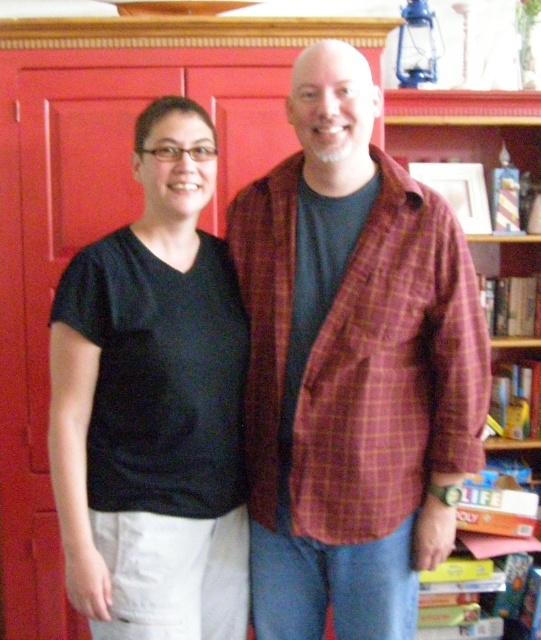
Question: Does plaid fabric shirt at center have a smaller size compared to wooden bookshelf at right?

Choices:
 (A) no
 (B) yes

Answer: (B)

Question: Where is plaid fabric shirt at center located in relation to wooden bookshelf at right in the image?

Choices:
 (A) left
 (B) right

Answer: (A)

Question: Is plaid fabric shirt at center to the left of black matte t-shirt at left from the viewer's perspective?

Choices:
 (A) no
 (B) yes

Answer: (A)

Question: Among these points, which one is farthest from the camera?

Choices:
 (A) (174, 593)
 (B) (417, 136)

Answer: (B)

Question: Which point is closer to the camera?

Choices:
 (A) (451, 477)
 (B) (444, 100)

Answer: (A)

Question: Which point is farther to the camera?

Choices:
 (A) black matte t-shirt at left
 (B) plaid fabric shirt at center
 (C) wooden bookshelf at right

Answer: (C)